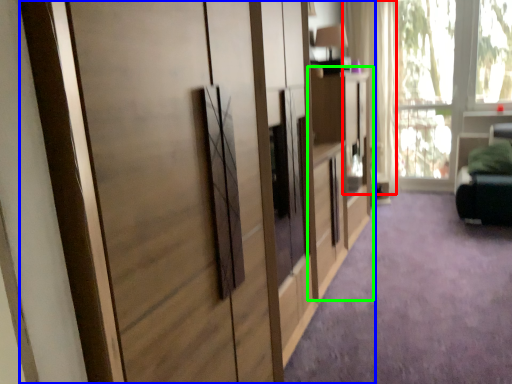
Question: Estimate the real-world distances between objects in this image. Which object is farther from curtain (highlighted by a red box), cupboard (highlighted by a blue box) or dresser (highlighted by a green box)?

Choices:
 (A) cupboard
 (B) dresser

Answer: (A)